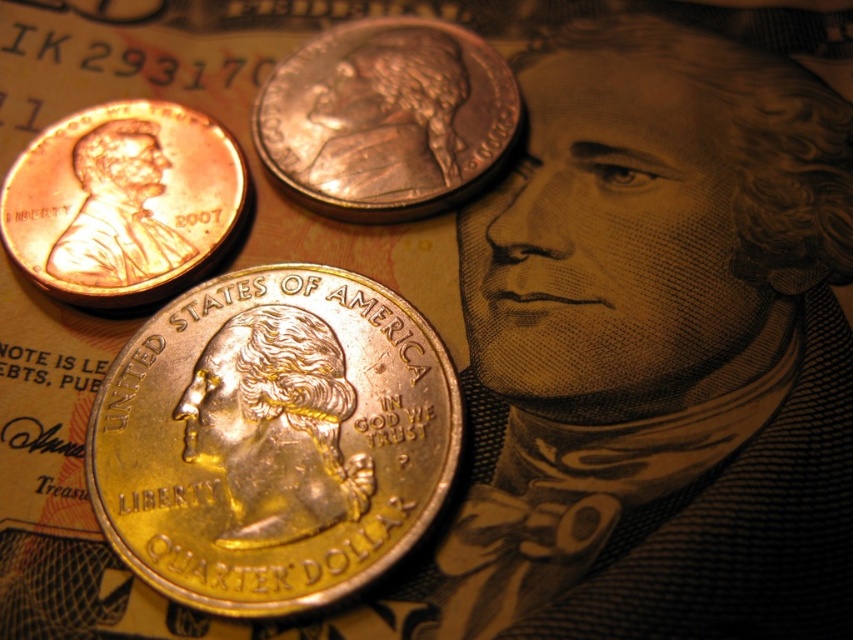
Question: Which object appears closest to the camera in this image?

Choices:
 (A) gold plated quarter at center
 (B) shiny copper coin at upper center

Answer: (A)

Question: Is gold plated quarter at center below copper/brass penny at upper left?

Choices:
 (A) yes
 (B) no

Answer: (A)

Question: Can you confirm if shiny copper coin at upper center is thinner than copper/brass penny at upper left?

Choices:
 (A) no
 (B) yes

Answer: (A)

Question: Is gold plated quarter at center behind copper/brass penny at upper left?

Choices:
 (A) yes
 (B) no

Answer: (B)

Question: Which is farther from the shiny copper coin at upper center?

Choices:
 (A) copper/brass penny at upper left
 (B) gold plated quarter at center

Answer: (B)

Question: Among these points, which one is nearest to the camera?

Choices:
 (A) (225, 592)
 (B) (142, 198)
 (C) (308, 54)

Answer: (A)